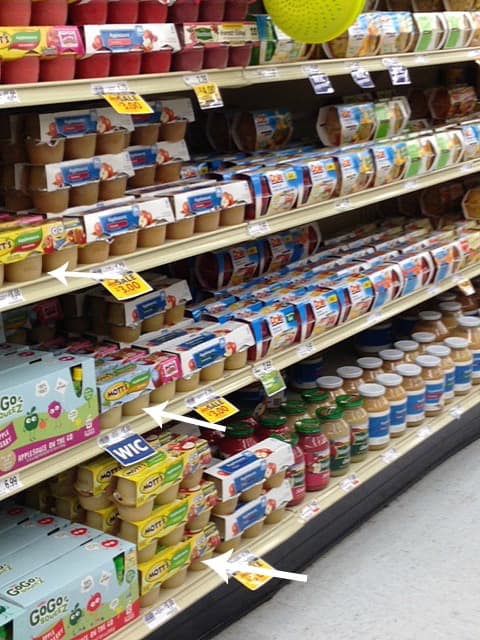
Image resolution: width=480 pixels, height=640 pixels. In order to click on tile floor in this screenshot , I will do `click(403, 608)`.